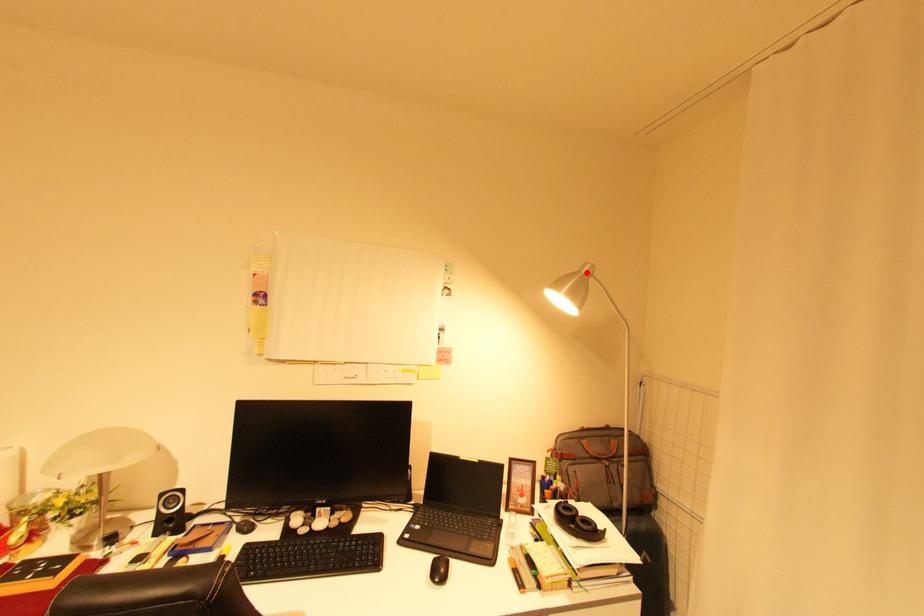
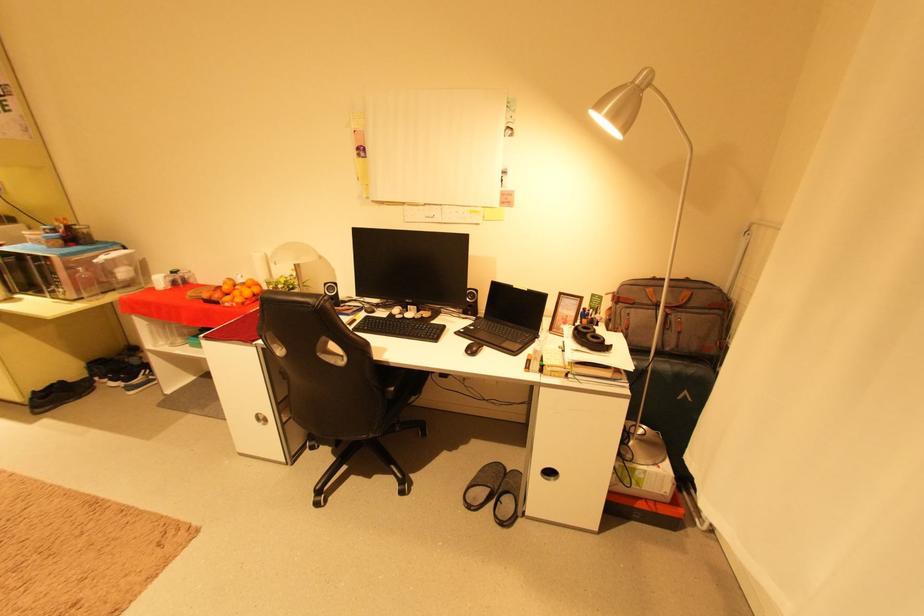
Locate, in the second image, the point that corresponds to the highlighted location in the first image.

(639, 83)